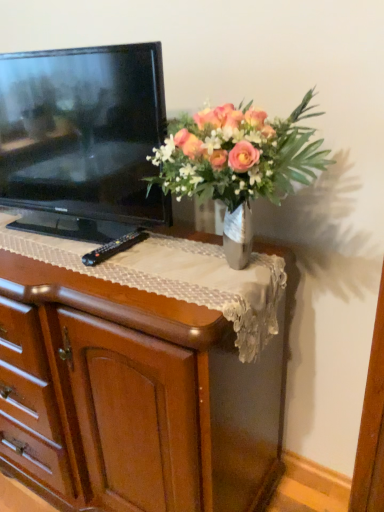
I want to click on free space to the back side of black plastic remote at center, so point(110,236).